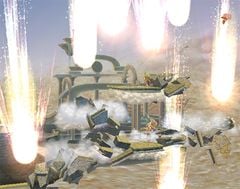
Identify the location of columns. This screenshot has height=189, width=240. (136, 116), (144, 108), (161, 108), (60, 86), (73, 79), (99, 79), (74, 134).